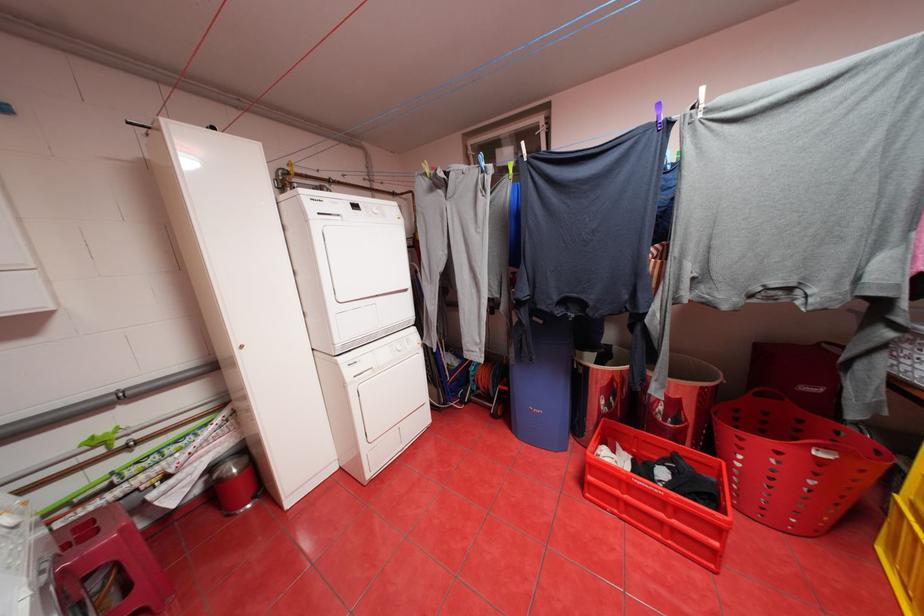
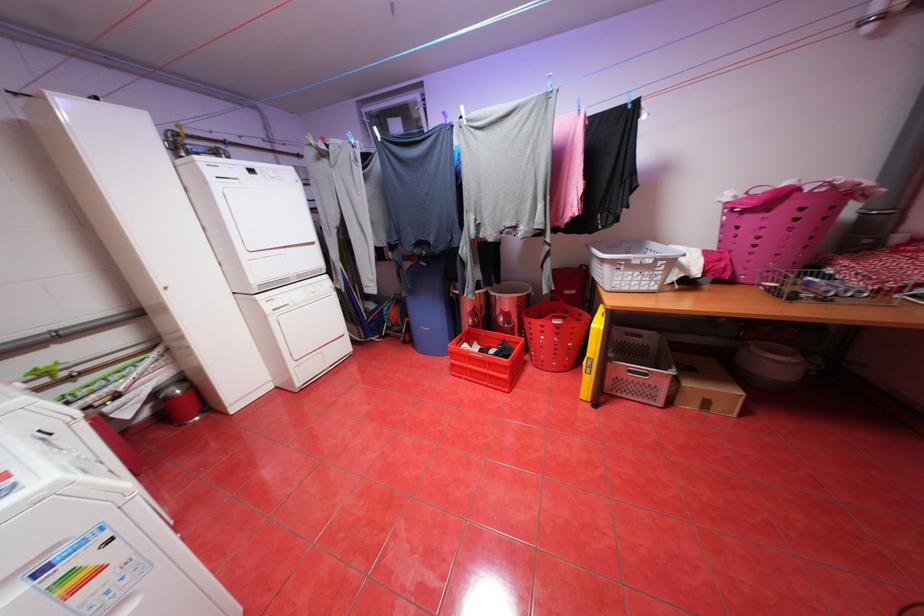
The point at (433, 174) is marked in the first image. Where is the corresponding point in the second image?

(320, 145)